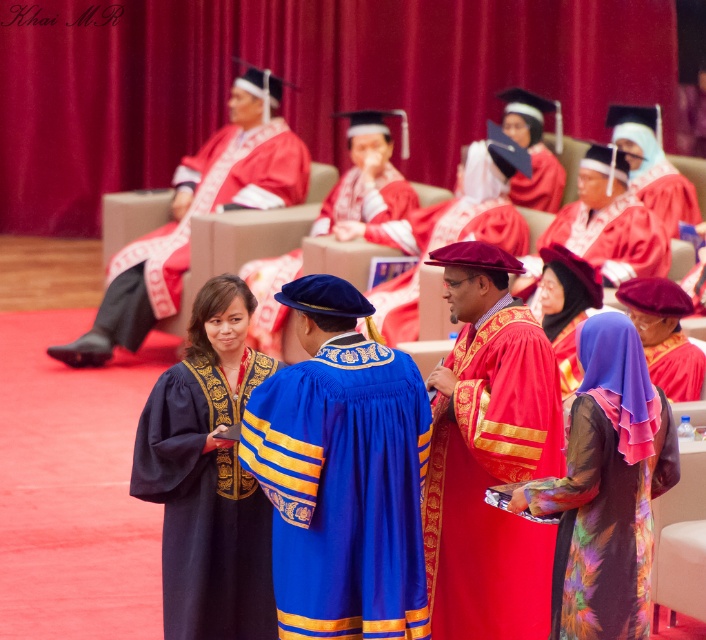
Who is positioned more to the left, multicolored chiffon hijab at center or velvet maroon beret at center?

From the viewer's perspective, velvet maroon beret at center appears more on the left side.

Who is shorter, multicolored chiffon hijab at center or velvet maroon beret at center?

multicolored chiffon hijab at center

Find the location of a particular element. This screenshot has width=706, height=640. multicolored chiffon hijab at center is located at coordinates (606, 486).

Find the location of a particular element. The image size is (706, 640). multicolored chiffon hijab at center is located at coordinates (606, 486).

Who is higher up, blue velvet gown at center or multicolored chiffon hijab at center?

blue velvet gown at center is higher up.

Is the position of blue velvet gown at center more distant than that of multicolored chiffon hijab at center?

No, blue velvet gown at center is closer to the viewer.

Measure the distance between point (306, 531) and camera.

A distance of 5.67 meters exists between point (306, 531) and camera.

What are the coordinates of `blue velvet gown at center` in the screenshot? It's located at (341, 474).

Between multicolored chiffon hijab at center and velvet blue graduation gown at center, which one is positioned lower?

multicolored chiffon hijab at center is lower down.

At what (x,y) coordinates should I click in order to perform the action: click on multicolored chiffon hijab at center. Please return your answer as a coordinate pair (x, y). Looking at the image, I should click on (606, 486).